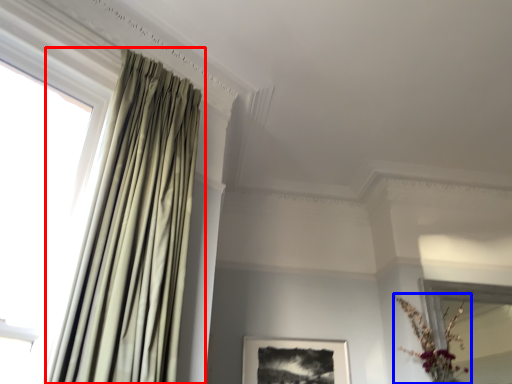
Question: Which of the following is the farthest to the observer, curtain (highlighted by a red box) or floral arrangement (highlighted by a blue box)?

Choices:
 (A) curtain
 (B) floral arrangement

Answer: (B)